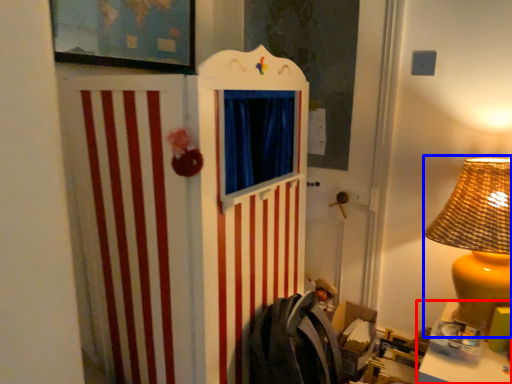
Question: Which object is closer to the camera taking this photo, table (highlighted by a red box) or table lamp (highlighted by a blue box)?

Choices:
 (A) table
 (B) table lamp

Answer: (A)